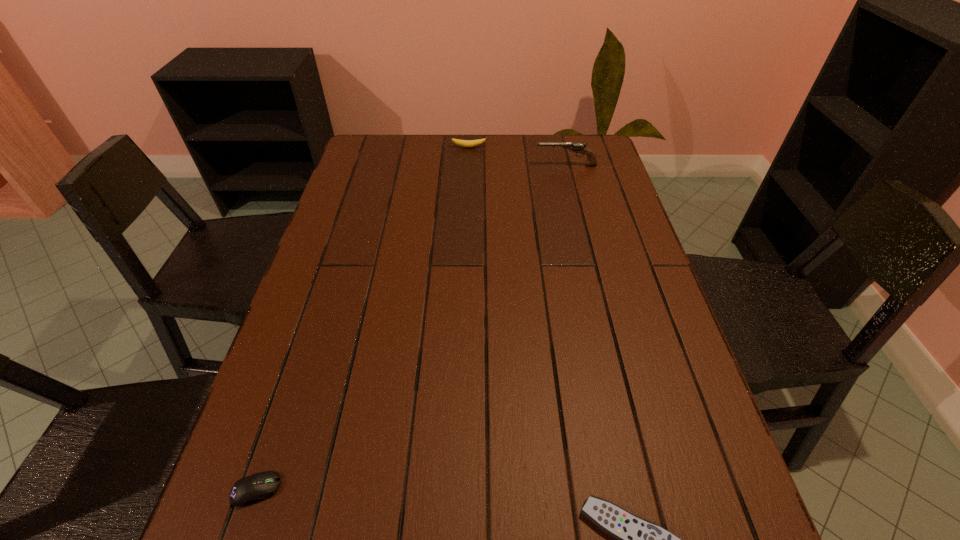
Locate an element on the screen. The image size is (960, 540). unoccupied area between the tallest object and the computer equipment is located at coordinates (411, 327).

The image size is (960, 540). Find the location of `empty location between the leftmost object and the second farthest object`. empty location between the leftmost object and the second farthest object is located at coordinates (411, 327).

What are the coordinates of `unoccupied position between the third object from right to left and the gun` in the screenshot? It's located at (517, 157).

Select which object is the second closest to the second shortest object. Please provide its 2D coordinates. Your answer should be formatted as a tuple, i.e. [(x, y)], where the tuple contains the x and y coordinates of a point satisfying the conditions above.

[(578, 147)]

The width and height of the screenshot is (960, 540). I want to click on object identified as the closest to the farthest object, so click(578, 147).

I want to click on vacant area that satisfies the following two spatial constraints: 1. aiming along the barrel of the gun; 2. on the front side of the third tallest object, so click(646, 489).